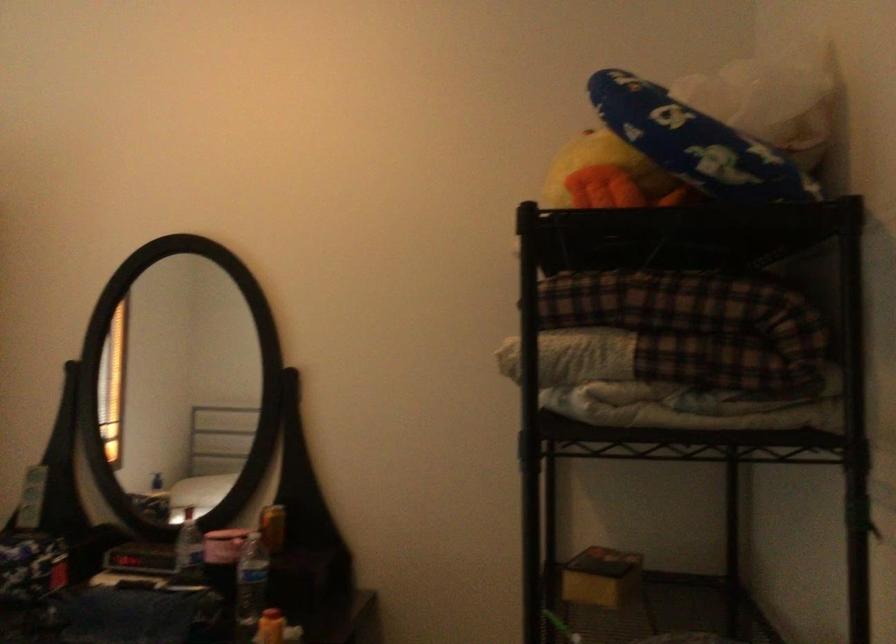
Find the location of a particular element. This screenshot has height=644, width=896. blue patterned pillow is located at coordinates (695, 143).